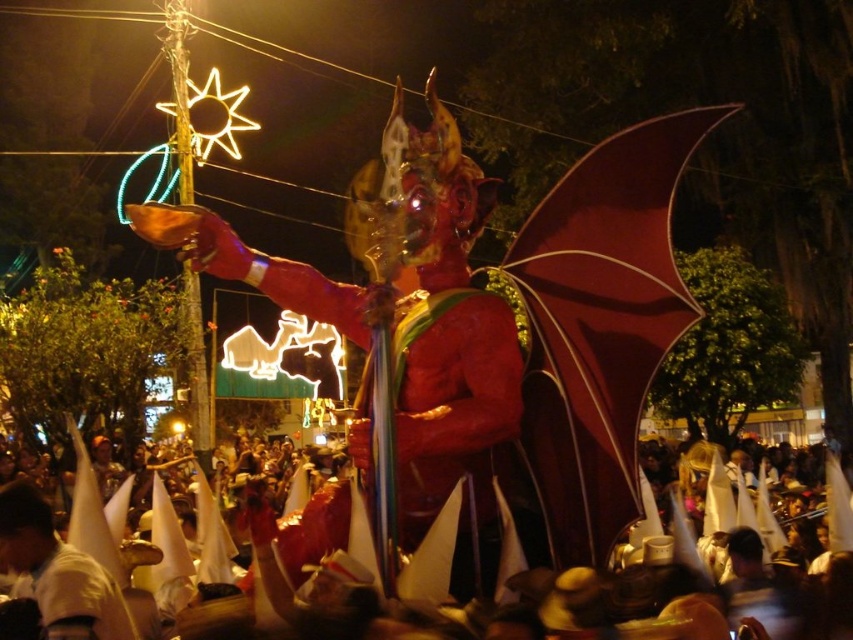
Does white paper hats at center have a smaller size compared to white matte cone at lower left?

No, white paper hats at center is not smaller than white matte cone at lower left.

Who is more distant from viewer, (846, 600) or (39, 513)?

Positioned behind is point (846, 600).

I want to click on white paper hats at center, so click(682, 598).

Where is `white paper hats at center`? Image resolution: width=853 pixels, height=640 pixels. white paper hats at center is located at coordinates (682, 598).